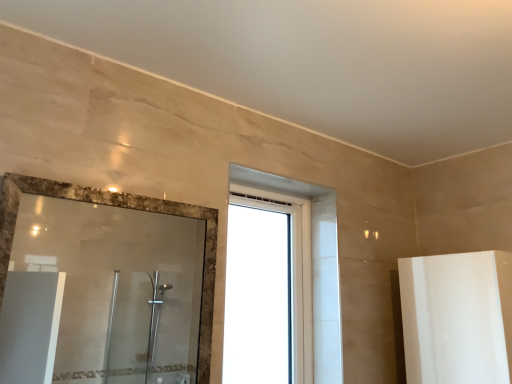
Question: From the image's perspective, is polished glass mirror at left above or below transparent glass window at center?

Choices:
 (A) above
 (B) below

Answer: (A)

Question: Which is correct: polished glass mirror at left is inside transparent glass window at center, or outside of it?

Choices:
 (A) outside
 (B) inside

Answer: (A)

Question: Considering the positions of point (188, 246) and point (316, 274), is point (188, 246) closer or farther from the camera than point (316, 274)?

Choices:
 (A) closer
 (B) farther

Answer: (B)

Question: From the image's perspective, relative to polished glass mirror at left, is transparent glass window at center above or below?

Choices:
 (A) above
 (B) below

Answer: (B)

Question: Do you think transparent glass window at center is within polished glass mirror at left, or outside of it?

Choices:
 (A) outside
 (B) inside

Answer: (A)

Question: From a real-world perspective, relative to polished glass mirror at left, is transparent glass window at center vertically above or below?

Choices:
 (A) above
 (B) below

Answer: (A)

Question: Visually, is transparent glass window at center positioned to the left or to the right of polished glass mirror at left?

Choices:
 (A) left
 (B) right

Answer: (B)